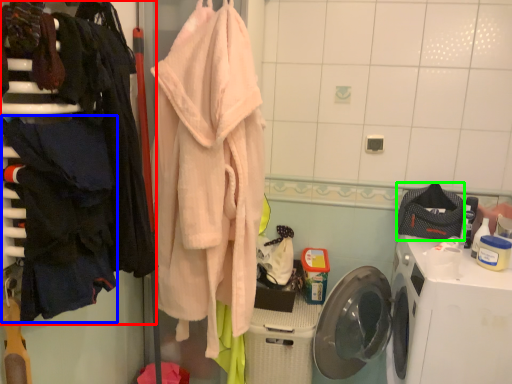
Question: Which object is the closest to the closet (highlighted by a red box)? Choose among these: clothing (highlighted by a blue box) or clothing (highlighted by a green box).

Choices:
 (A) clothing
 (B) clothing

Answer: (A)